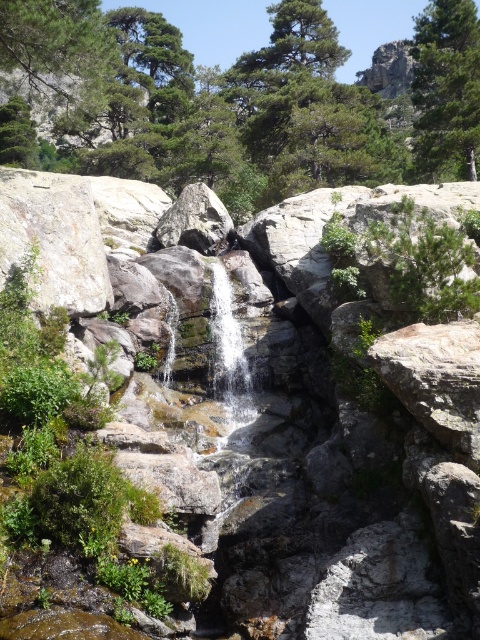
Is smooth gray rock at center smaller than green leafy tree at upper center?

Indeed, smooth gray rock at center has a smaller size compared to green leafy tree at upper center.

Is point (120, 348) more distant than point (472, 20)?

No, it is not.

This screenshot has width=480, height=640. What do you see at coordinates (274, 467) in the screenshot?
I see `smooth gray rock at center` at bounding box center [274, 467].

At what (x,y) coordinates should I click in order to perform the action: click on smooth gray rock at center. Please return your answer as a coordinate pair (x, y). The image size is (480, 640). Looking at the image, I should click on (274, 467).

Which is below, green leafy tree at upper center or clear water at center?

clear water at center is below.

How distant is green leafy tree at upper center from clear water at center?

green leafy tree at upper center is 103.53 feet from clear water at center.

Who is more distant from viewer, [432,22] or [226,282]?

Positioned behind is point [432,22].

Identify the location of green leafy tree at upper center. (446, 86).

Where is `smooth gray rock at center`? smooth gray rock at center is located at coordinates (274, 467).

Is smooth gray rock at center below clear water at center?

No, smooth gray rock at center is not below clear water at center.

Find the location of a particular element. smooth gray rock at center is located at coordinates (274, 467).

Where is `smooth gray rock at center`? This screenshot has height=640, width=480. smooth gray rock at center is located at coordinates (274, 467).